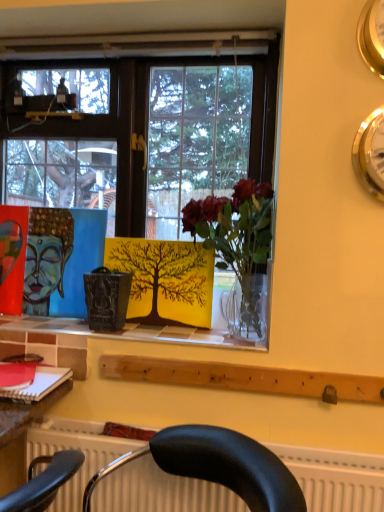
Question: Looking at the image, does yellow matte tree at center seem bigger or smaller compared to white tile at center?

Choices:
 (A) big
 (B) small

Answer: (B)

Question: Is yellow matte tree at center spatially inside white tile at center, or outside of it?

Choices:
 (A) outside
 (B) inside

Answer: (A)

Question: Considering the real-world distances, which object is farthest from the white tile at center?

Choices:
 (A) gold metallic clock at upper right, the 1th clock when ordered from bottom to top
 (B) translucent glass vase at center
 (C) gold metallic clock at upper right, which ranks as the first clock in top-to-bottom order
 (D) white textured radiator at lower center
 (E) yellow matte tree at center

Answer: (C)

Question: Which is nearer to the matte red book at lower left?

Choices:
 (A) translucent glass vase at center
 (B) yellow matte tree at center
 (C) white tile at center
 (D) white textured radiator at lower center
 (E) matte blue painting at center

Answer: (C)